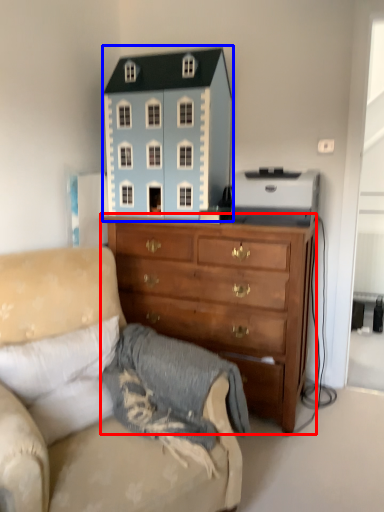
Question: Which object appears farthest to the camera in this image, chest of drawers (highlighted by a red box) or toy (highlighted by a blue box)?

Choices:
 (A) chest of drawers
 (B) toy

Answer: (B)